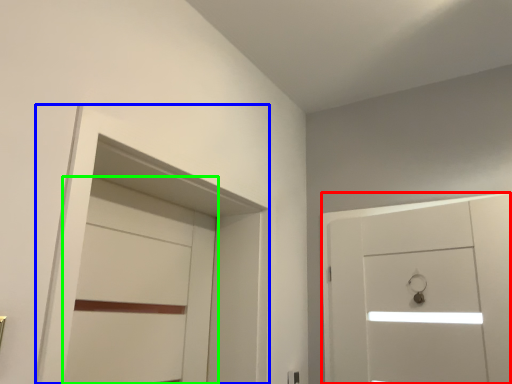
Question: Which object is the farthest from door (highlighted by a red box)? Choose among these: locker (highlighted by a blue box) or door (highlighted by a green box).

Choices:
 (A) locker
 (B) door

Answer: (B)